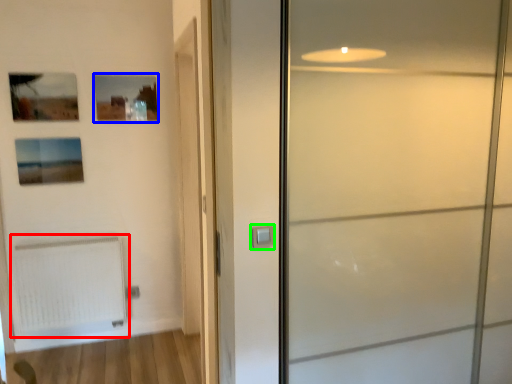
Question: Which object is the farthest from radiator (highlighted by a red box)? Choose among these: picture frame (highlighted by a blue box) or door handle (highlighted by a green box).

Choices:
 (A) picture frame
 (B) door handle

Answer: (B)